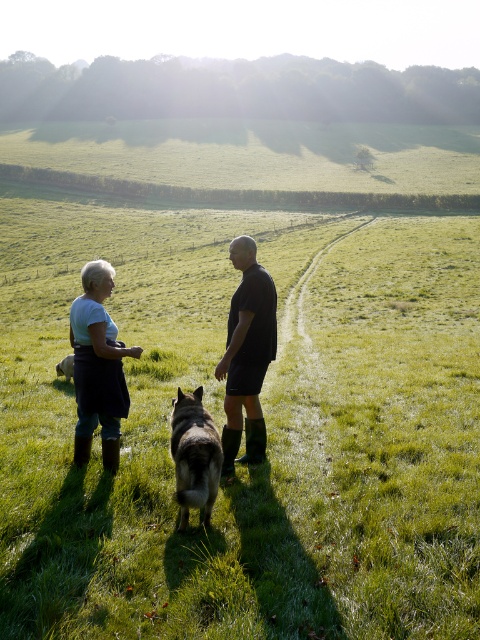
You are a photographer trying to capture a photo of both the dark gray fur at center and the brown fur dog at lower left. Since you want both subjects to be clearly visible in the frame, which one should you focus on first to ensure proper focus given their sizes?

The dark gray fur at center should be focused on first because it has a greater height compared to the brown fur dog at lower left, making it larger in the frame and thus requiring precise focus to ensure clarity.

You are a photographer trying to capture a group photo of the white cotton shirt at left and the dark gray fur at center. Since you want everyone to be facing forward, which subject should you position closer to the camera to ensure both are fully visible in the photo?

The dark gray fur at center is behind the white cotton shirt at left, so you should position the white cotton shirt at left closer to the camera to ensure both are fully visible in the photo.

In the rural scene, there are two people and a dog on a grassy path. The person on the left is wearing a light top and dark shorts, while the other person is in a dark T shirt and shorts with dark boots. The dog is between them. There is also a point marked at coordinates point (x=247, y=355). Which of the two people is wearing the dark matte shirt at center?

The dark matte shirt at center is represented by point (x=247, y=355), so the person wearing it is the one positioned at that coordinate.